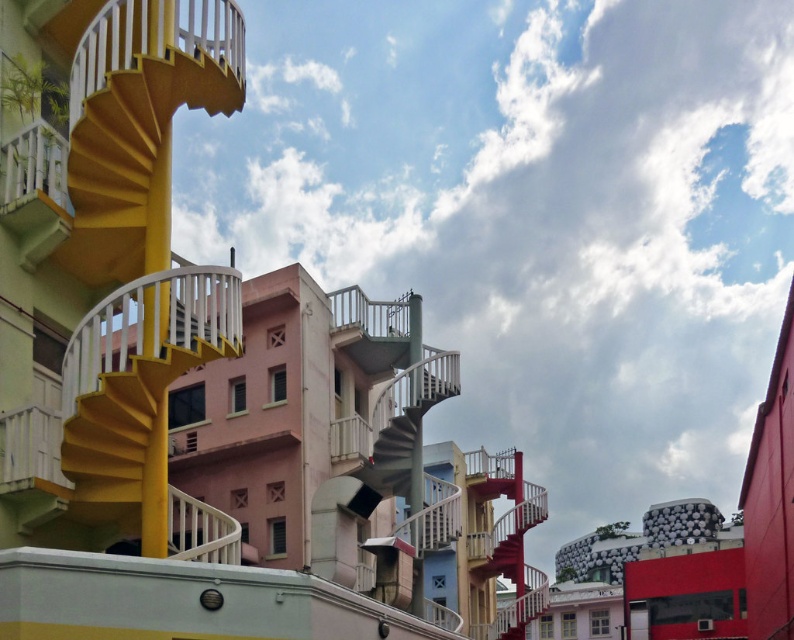
You are standing at the base of the spiral staircase in the urban scene. You notice two points marked on the staircase. The first point is at coordinates point (x=141, y=426) and the second is at point (x=357, y=426). Which point is closer to you as you face the staircase?

Point (x=141, y=426) is closer to the camera than point (x=357, y=426). Since you are facing the staircase, the point at (x=141, y=426) would be closer to you.

You are an architect reviewing a design blueprint. The yellow matte spiral staircase at left is located at coordinates 0.591, 0.252. If the building plans require the staircase to be placed exactly at the center of the design layout, would its current position meet this requirement?

The yellow matte spiral staircase at left is positioned at point (199, 378), which is not the exact center of the design layout. Therefore, its current position does not meet the requirement.

You are an architect analyzing the layout of this urban space. You need to determine the spatial relationship between the yellow matte spiral staircase at left and the metallic gray staircase at center. From the perspective of someone facing the building, which staircase is positioned to the left?

The yellow matte spiral staircase at left is positioned to the left of the metallic gray staircase at center.